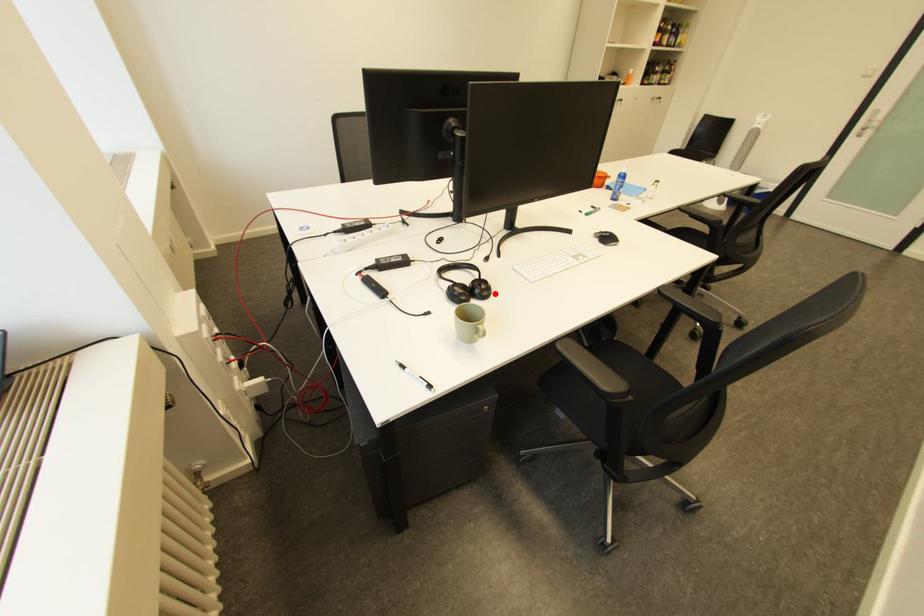
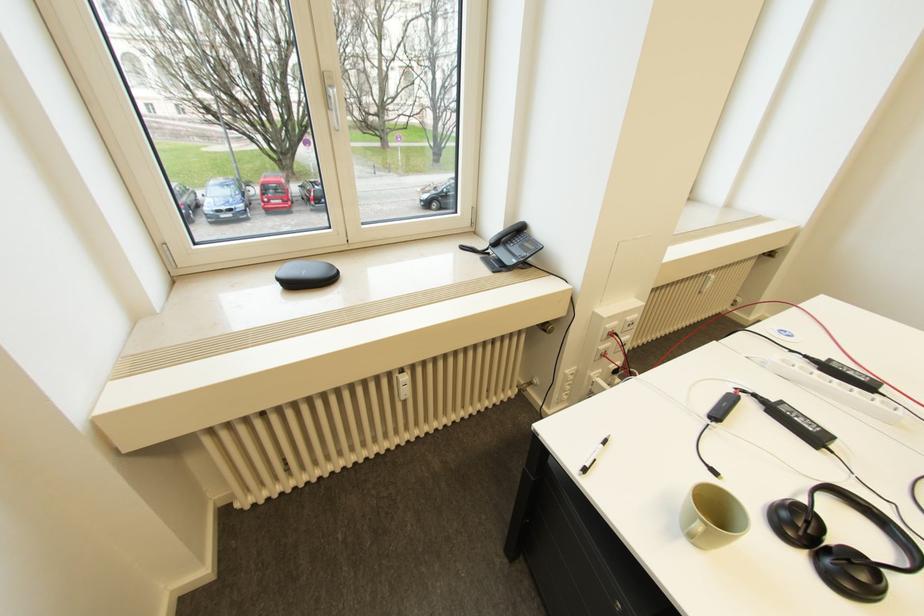
In the second image, find the point that corresponds to the highlighted location in the first image.

(857, 586)